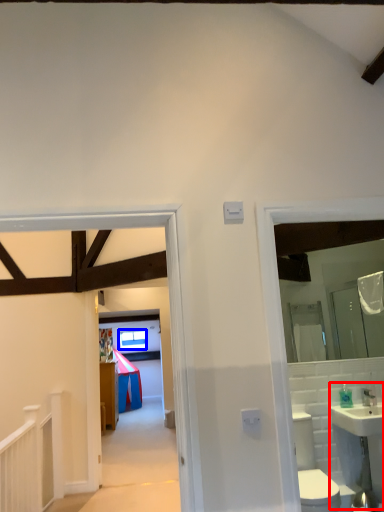
Question: Which of the following is the farthest to the observer, sink (highlighted by a red box) or window (highlighted by a blue box)?

Choices:
 (A) sink
 (B) window

Answer: (B)